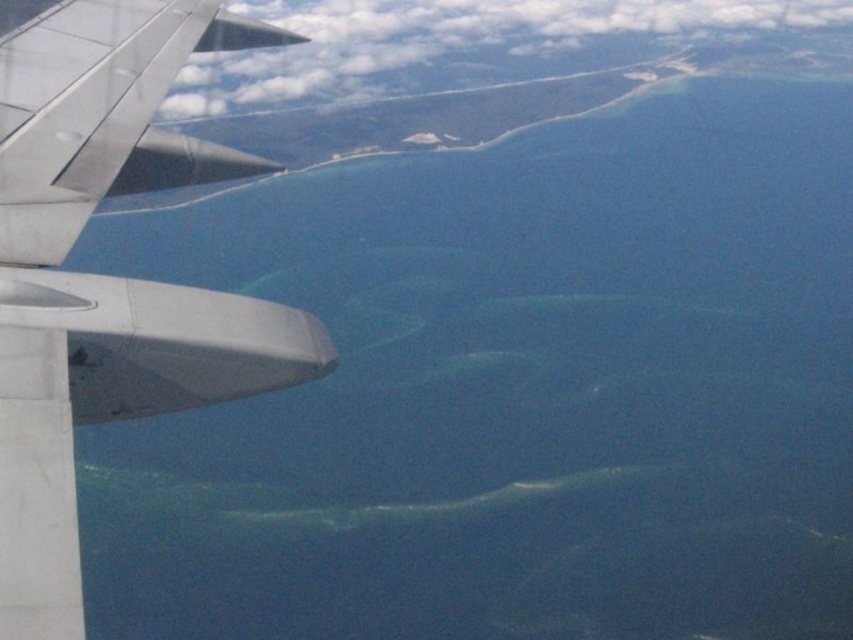
Question: Which of the following is the closest to the observer?

Choices:
 (A) white fluffy cloud at upper center
 (B) metallic gray wing at left

Answer: (B)

Question: Considering the relative positions of metallic gray wing at left and white fluffy cloud at upper center in the image provided, where is metallic gray wing at left located with respect to white fluffy cloud at upper center?

Choices:
 (A) left
 (B) right

Answer: (A)

Question: From the image, what is the correct spatial relationship of metallic gray wing at left in relation to white fluffy cloud at upper center?

Choices:
 (A) above
 (B) below

Answer: (B)

Question: Is metallic gray wing at left bigger than white fluffy cloud at upper center?

Choices:
 (A) yes
 (B) no

Answer: (B)

Question: Which point is closer to the camera taking this photo?

Choices:
 (A) [96, 378]
 (B) [572, 26]

Answer: (A)

Question: Which point appears closest to the camera in this image?

Choices:
 (A) (339, 38)
 (B) (173, 364)

Answer: (B)